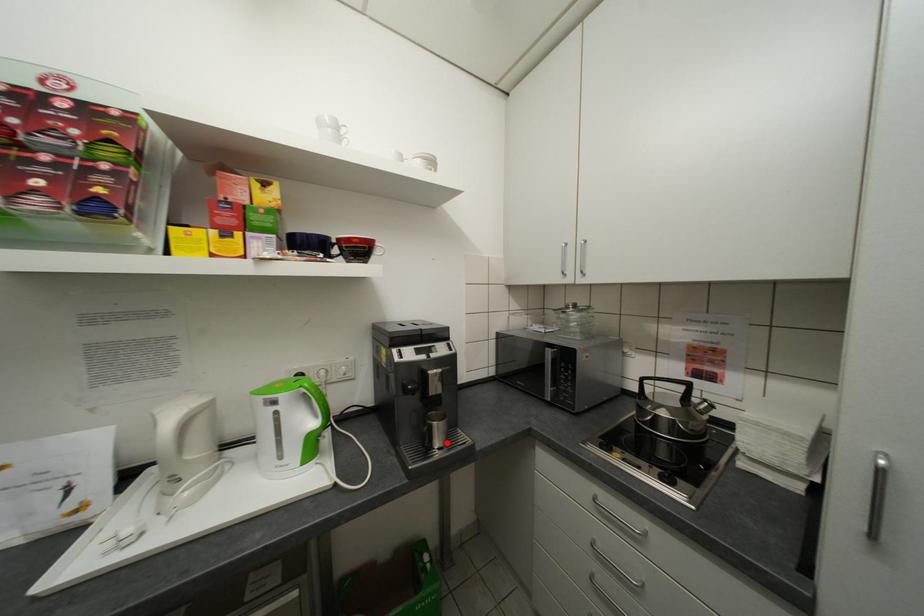
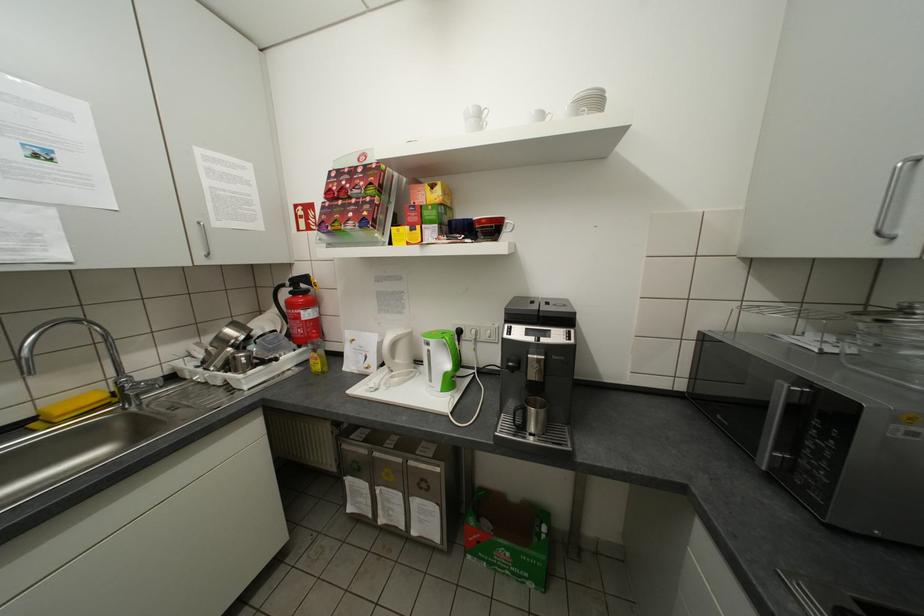
In the second image, find the point that corresponds to the highlighted location in the first image.

(541, 428)